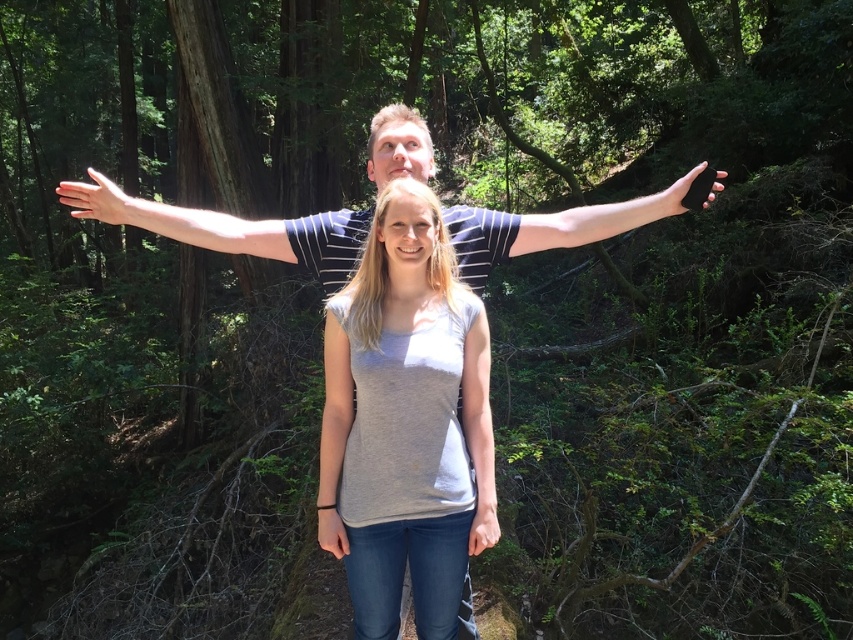
Question: Where is smooth skin arm at left located in relation to black matte phone at right in the image?

Choices:
 (A) below
 (B) above

Answer: (A)

Question: Which point is closer to the camera?

Choices:
 (A) (477, 525)
 (B) (100, 211)
 (C) (453, 516)
 (D) (477, 412)

Answer: (C)

Question: Does smooth skin arm at left appear on the left side of black matte arm at upper right?

Choices:
 (A) yes
 (B) no

Answer: (A)

Question: Which of the following is the closest to the observer?

Choices:
 (A) (492, 506)
 (B) (642, 196)
 (C) (132, 216)
 (D) (694, 188)

Answer: (A)

Question: Can you confirm if smooth skin arm at left is bigger than matte black phone at lower center?

Choices:
 (A) yes
 (B) no

Answer: (B)

Question: Which object is the closest to the black matte arm at upper right?

Choices:
 (A) gray matte tank top at center
 (B) black matte phone at right
 (C) gray cotton t-shirt at center

Answer: (B)